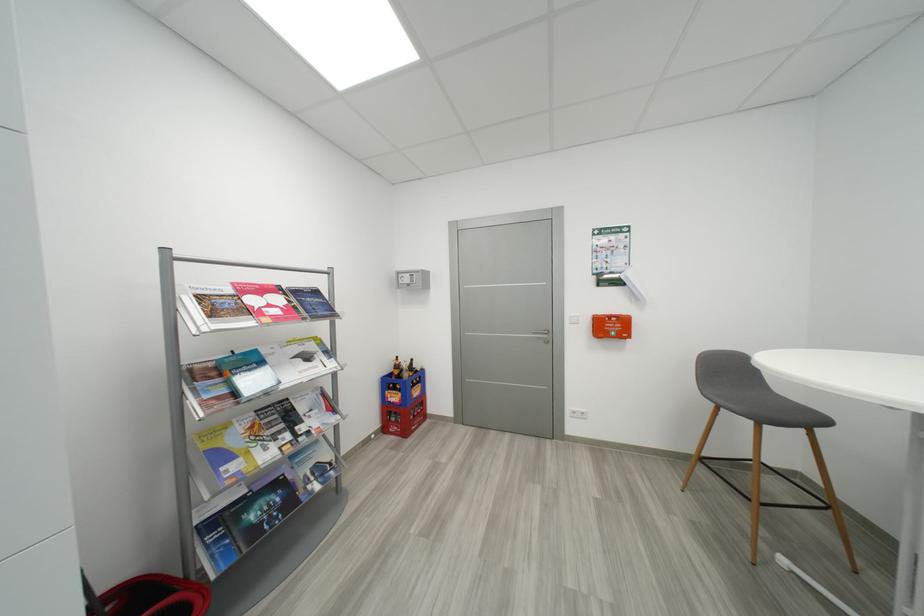
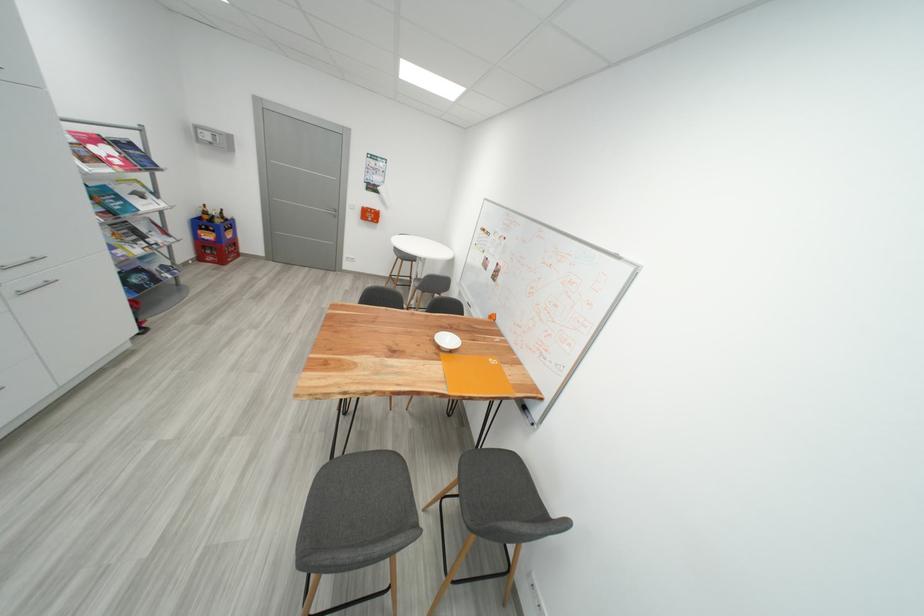
The point at [411,366] is marked in the first image. Where is the corresponding point in the second image?

(220, 214)